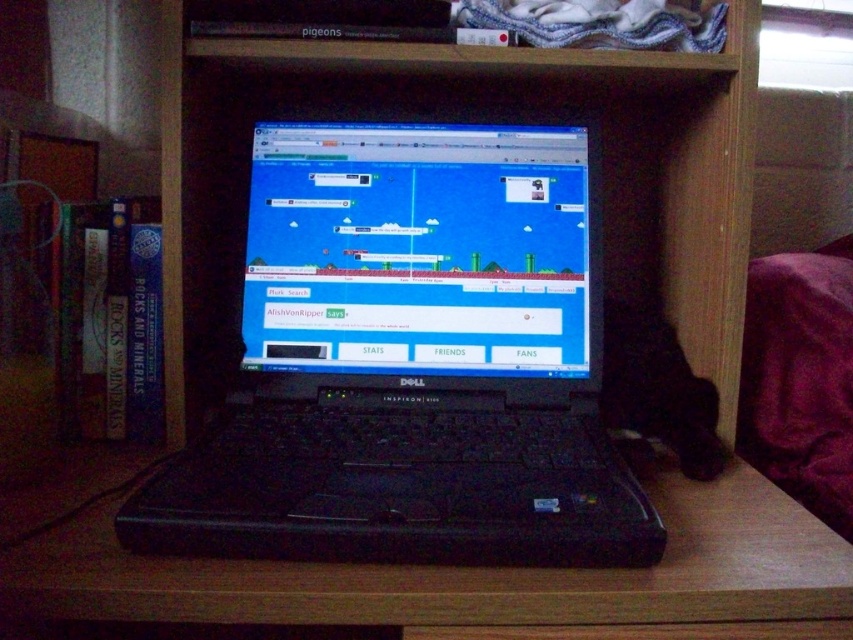
You are trying to determine if the black plastic laptop at center can fit into a storage box that is the same height as the black plastic table at center. Based on the scene description, will the laptop fit vertically?

The black plastic laptop at center is much taller than the black plastic table at center, so it will not fit vertically into a storage box of the table height.

Looking at this image, you are standing in front of the Dell Inspiron laptop on the wooden desk. You notice a point marked at coordinates (178, 548). If your eyes are at the same level as the laptop screen, can you reach that point without moving your head?

The point at (178, 548) is 21.92 inches away from the viewer. Since 21.92 inches is approximately 55.68 centimeters, which is a considerable distance, you would need to move your head or lean forward to reach it. Therefore, you cannot reach that point without moving your head.

You are setting up a new monitor stand and need to place it exactly where the black plastic laptop at center is currently located. According to the coordinates provided, where should you position the stand?

The black plastic laptop at center is located at point [410,360], so you should position the stand at those coordinates.